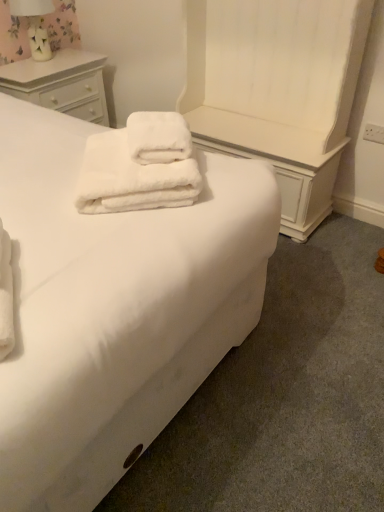
Question: Is white soft bed at center directly adjacent to floral fabric lampshade at upper left?

Choices:
 (A) yes
 (B) no

Answer: (B)

Question: Is white soft bed at center at the right side of floral fabric lampshade at upper left?

Choices:
 (A) no
 (B) yes

Answer: (B)

Question: From a real-world perspective, is white soft bed at center over floral fabric lampshade at upper left?

Choices:
 (A) yes
 (B) no

Answer: (B)

Question: Would you consider white soft bed at center to be distant from floral fabric lampshade at upper left?

Choices:
 (A) no
 (B) yes

Answer: (B)

Question: Does white soft bed at center contain floral fabric lampshade at upper left?

Choices:
 (A) yes
 (B) no

Answer: (B)

Question: Is white soft bed at center situated inside floral fabric lampshade at upper left or outside?

Choices:
 (A) outside
 (B) inside

Answer: (A)

Question: From a real-world perspective, is white soft bed at center above or below floral fabric lampshade at upper left?

Choices:
 (A) below
 (B) above

Answer: (A)

Question: Looking at the image, does white soft bed at center seem bigger or smaller compared to floral fabric lampshade at upper left?

Choices:
 (A) small
 (B) big

Answer: (B)

Question: From the image's perspective, is white soft bed at center above or below floral fabric lampshade at upper left?

Choices:
 (A) above
 (B) below

Answer: (B)

Question: From a real-world perspective, is white soft bed at center positioned above or below white wood chest of drawers at upper left?

Choices:
 (A) above
 (B) below

Answer: (A)

Question: In terms of size, does white soft bed at center appear bigger or smaller than white wood chest of drawers at upper left?

Choices:
 (A) small
 (B) big

Answer: (B)

Question: Based on their positions, is white soft bed at center located to the left or right of white wood chest of drawers at upper left?

Choices:
 (A) left
 (B) right

Answer: (B)

Question: Considering the positions of white soft bed at center and white wood chest of drawers at upper left in the image, is white soft bed at center taller or shorter than white wood chest of drawers at upper left?

Choices:
 (A) short
 (B) tall

Answer: (B)

Question: Is white fluffy towels at center inside or outside of white soft bed at center?

Choices:
 (A) outside
 (B) inside

Answer: (B)

Question: From the image's perspective, is white fluffy towels at center above or below white soft bed at center?

Choices:
 (A) above
 (B) below

Answer: (A)